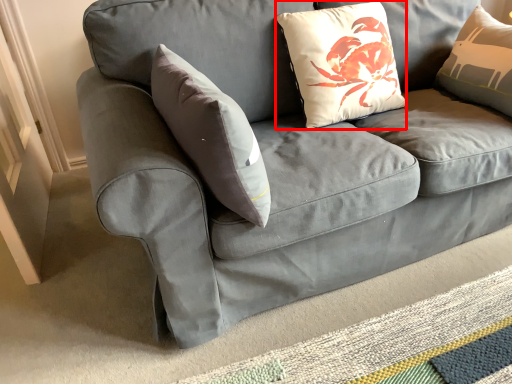
Question: From the image's perspective, considering the relative positions of pillow (annotated by the red box) and mat in the image provided, where is pillow (annotated by the red box) located with respect to the staircase?

Choices:
 (A) above
 (B) below

Answer: (A)